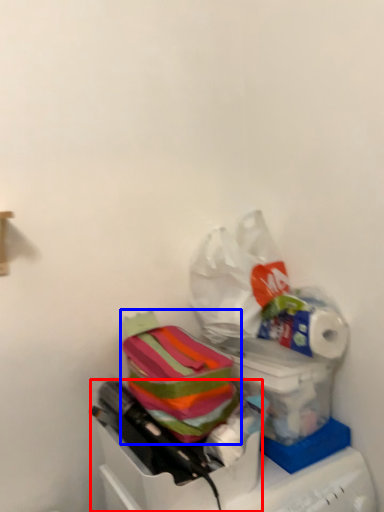
Question: Which point is further to the camera, box (highlighted by a red box) or material (highlighted by a blue box)?

Choices:
 (A) box
 (B) material

Answer: (B)